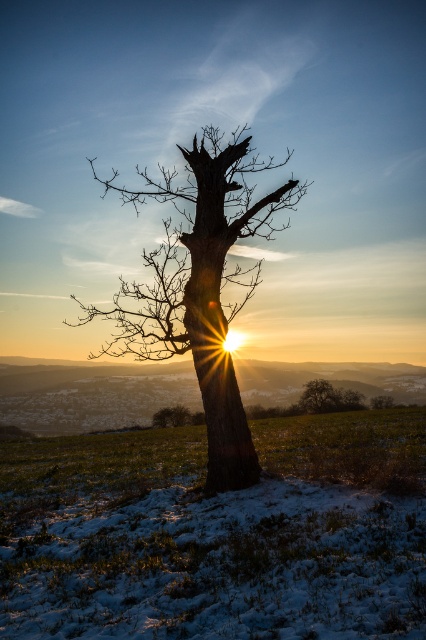
Who is higher up, snowy grass at center or smooth brown tree at center?

Positioned higher is snowy grass at center.

Locate an element on the screen. This screenshot has height=640, width=426. snowy grass at center is located at coordinates (216, 534).

Between point (331, 486) and point (304, 403), which one is positioned behind?

The point (304, 403) is behind.

Locate an element on the screen. This screenshot has height=640, width=426. snowy grass at center is located at coordinates (216, 534).

Between dark brown bark tree at center and smooth bark tree trunk at center, which one appears on the left side from the viewer's perspective?

dark brown bark tree at center is more to the left.

Locate an element on the screen. Image resolution: width=426 pixels, height=640 pixels. dark brown bark tree at center is located at coordinates (201, 288).

Locate an element on the screen. The width and height of the screenshot is (426, 640). dark brown bark tree at center is located at coordinates (201, 288).

Does smooth bark tree trunk at center have a smaller size compared to smooth brown tree at center?

Correct, smooth bark tree trunk at center occupies less space than smooth brown tree at center.

Is smooth bark tree trunk at center bigger than smooth brown tree at center?

Actually, smooth bark tree trunk at center might be smaller than smooth brown tree at center.

Where is `smooth bark tree trunk at center`? smooth bark tree trunk at center is located at coordinates (215, 356).